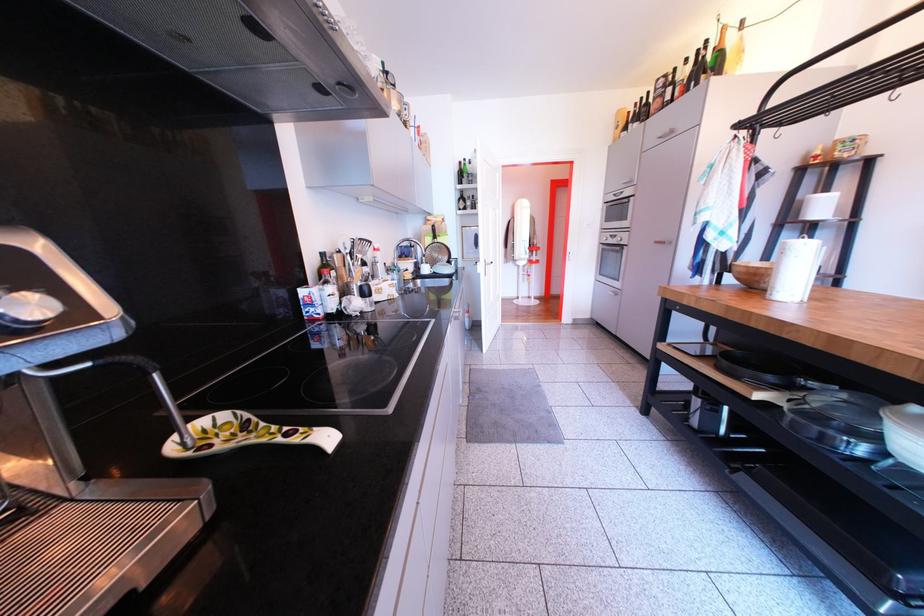
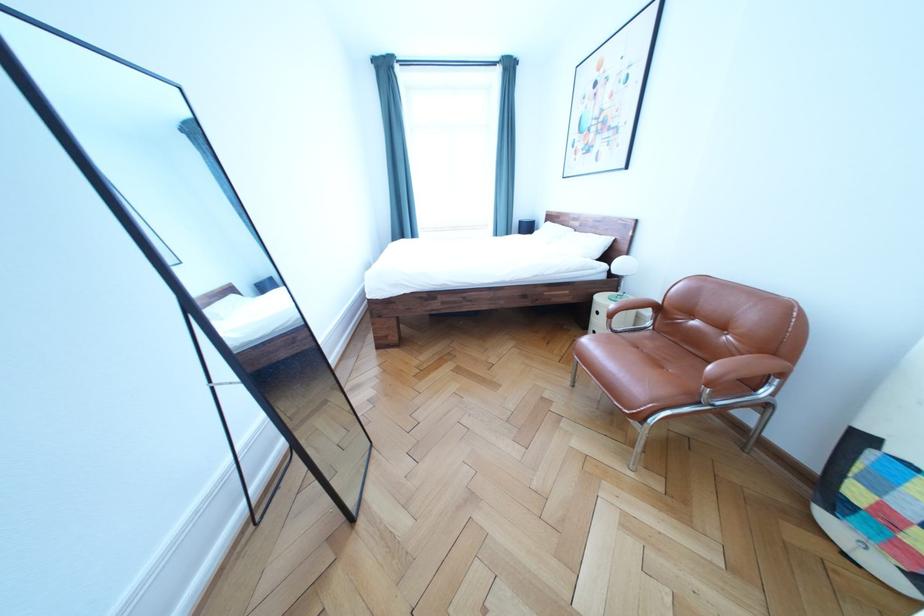
Question: I am providing you with two images of the same scene from different viewpoints. After the viewpoint changes to image2, which objects are now occluded?

Choices:
 (A) nightstand drawer handle
 (B) small puzzle cube
 (C) chair sitting surface
 (D) glass lid handle

Answer: (D)